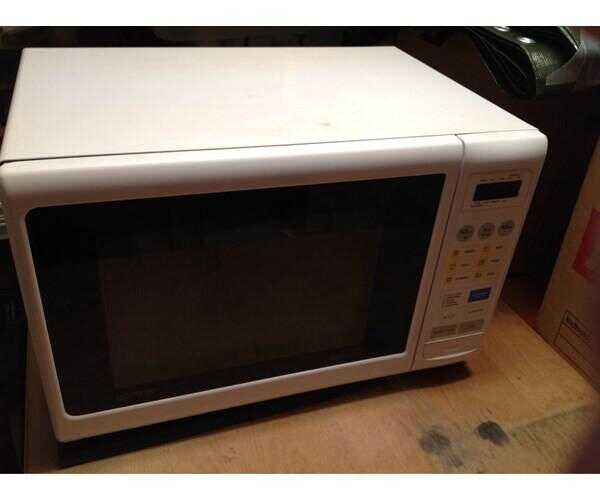
At what (x,y) coordinates should I click in order to perform the action: click on 1 box on right side of microwave. Please return your answer as a coordinate pair (x, y). The image size is (600, 500). Looking at the image, I should click on (582, 296).